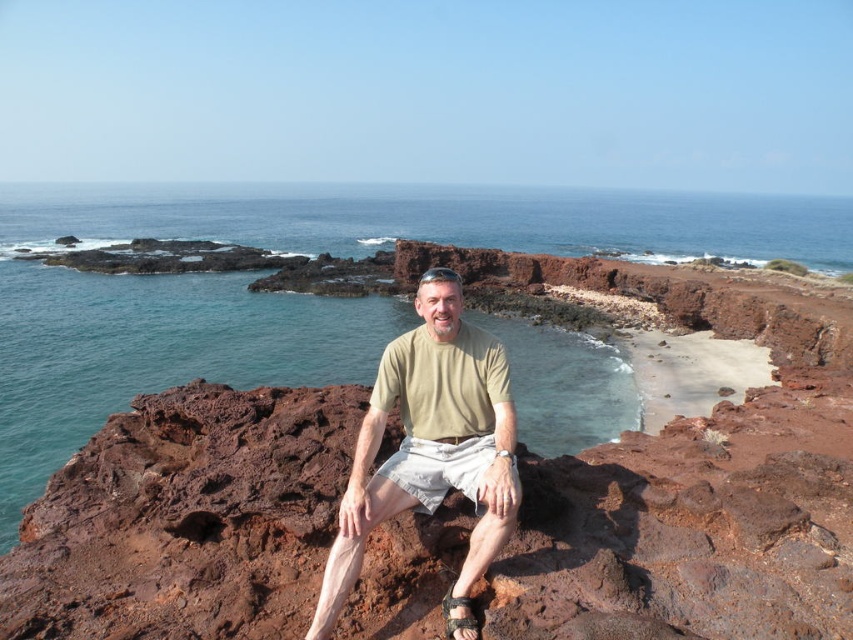
You are standing on the rugged, reddish brown volcanic rock formations where the man is sitting. You want to take a photo of the clear blue water at center. Where should you point your camera?

You should point your camera towards the center of the image at coordinates point (296,292) to capture the clear blue water at center.

You are a photographer trying to capture the scene. You want to ensure that the clear blue water at center and the light brown cotton shirt at center are both visible in the frame. Which object should you adjust your camera to focus on first to ensure both are in the frame?

The clear blue water at center is wider than the light brown cotton shirt at center, so focus on the wider clear blue water at center first to ensure both fit in the frame.

You are a photographer aiming to capture the clear blue water at center and the light brown cotton shirt at center in the same frame. Based on their positions, which object should you adjust your camera to focus on first to ensure both are in the shot?

The clear blue water at center is to the left of the light brown cotton shirt at center, so you should focus on the light brown cotton shirt at center first to ensure both are included in the frame.